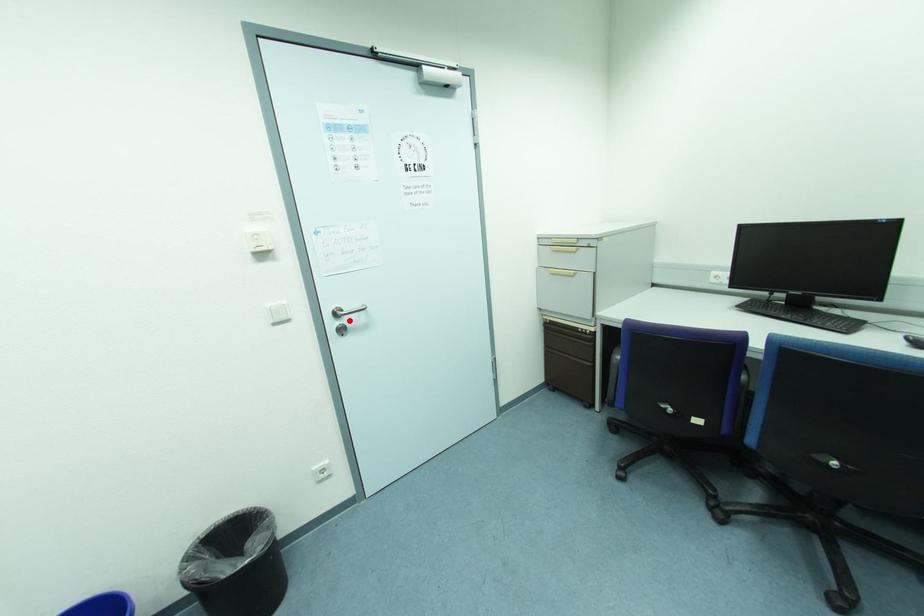
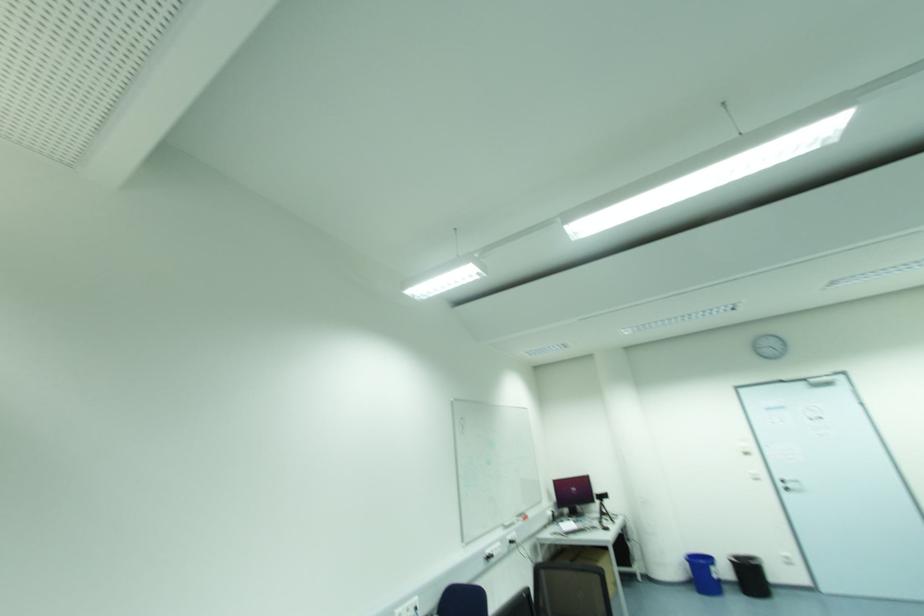
Where in the second image is the point corresponding to the highlighted location from the first image?

(789, 485)